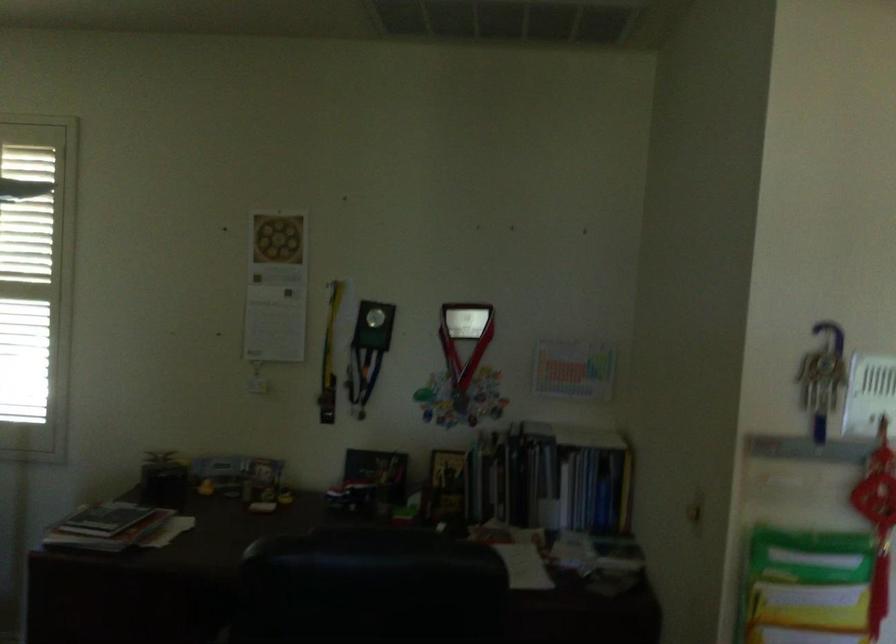
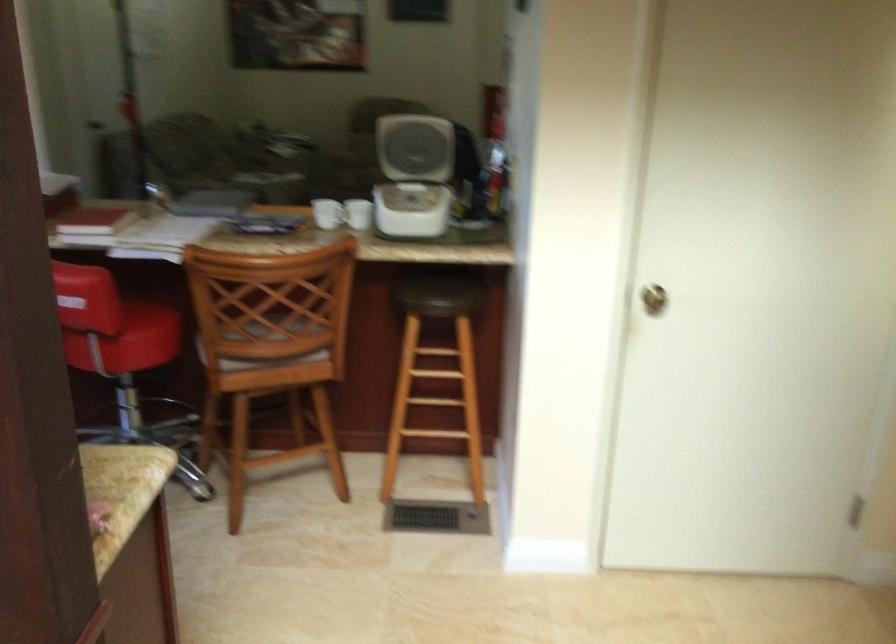
Question: I am providing you with two images of the same scene from different viewpoints. Which of the following objects are not visible in image2?

Choices:
 (A) red chair sitting surface
 (B) book
 (C) white coffee mug
 (D) small condiment jar

Answer: (B)